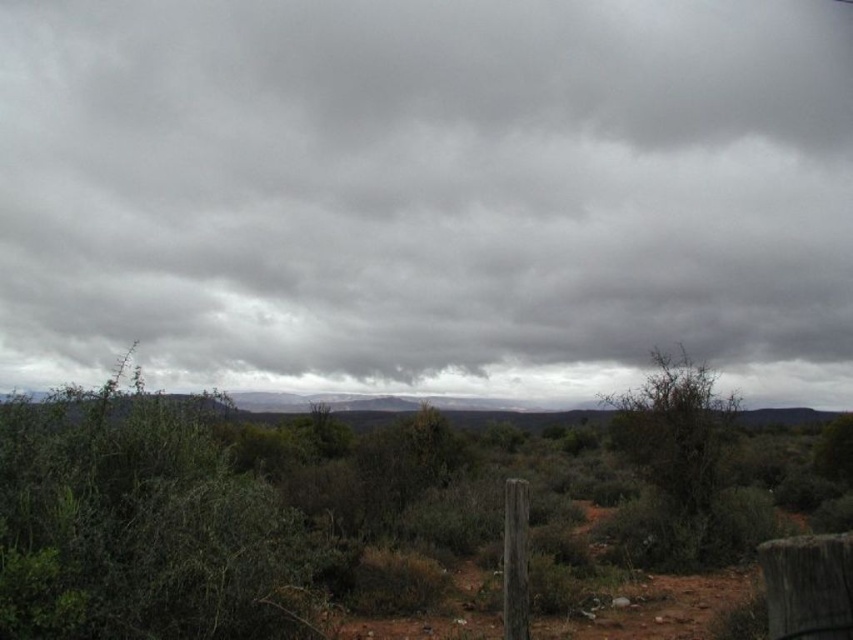
You are standing on the dirt path and looking towards the distant hills. Which object, the gray matte cloud at upper center or the green leafy bush at center, is closer to your eye level?

The green leafy bush at center is closer to your eye level because it is positioned at the center, while the gray matte cloud at upper center is taller and located higher up in the sky.

You are standing in the open landscape depicted in the image. There is a point marked as point [427,195]. What object in the scene corresponds to this coordinate?

The gray matte cloud at upper center is represented by point [427,195].